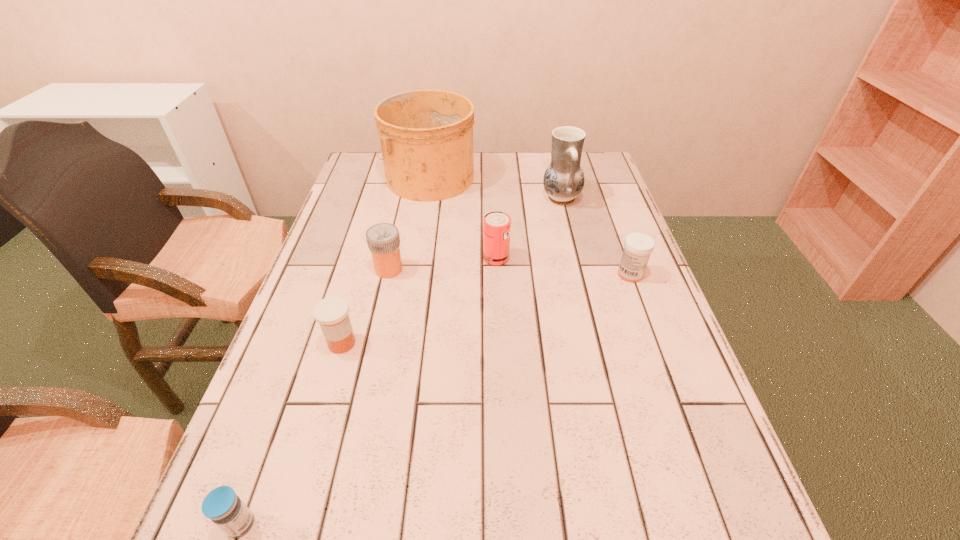
Where is `bucket`? The image size is (960, 540). bucket is located at coordinates (426, 136).

Locate an element on the screen. This screenshot has width=960, height=540. pottery is located at coordinates (563, 181).

Find the location of a particular element. Image resolution: width=960 pixels, height=540 pixels. can is located at coordinates (496, 225).

In order to click on the second nearest object in this screenshot , I will do `click(331, 313)`.

The height and width of the screenshot is (540, 960). I want to click on the rightmost medicine, so click(638, 246).

The width and height of the screenshot is (960, 540). Identify the location of the leftmost medicine. (221, 505).

Identify the location of the shortest object. (221, 505).

Where is `free space located on the front of the bucket`? This screenshot has height=540, width=960. free space located on the front of the bucket is located at coordinates (423, 212).

Locate an element on the screen. free space located 0.080m on the left of the sixth object from left to right is located at coordinates (516, 199).

At what (x,y) coordinates should I click in order to perform the action: click on free space located 0.350m on the left of the fifth object from left to right. Please return your answer as a coordinate pair (x, y). Looking at the image, I should click on (349, 258).